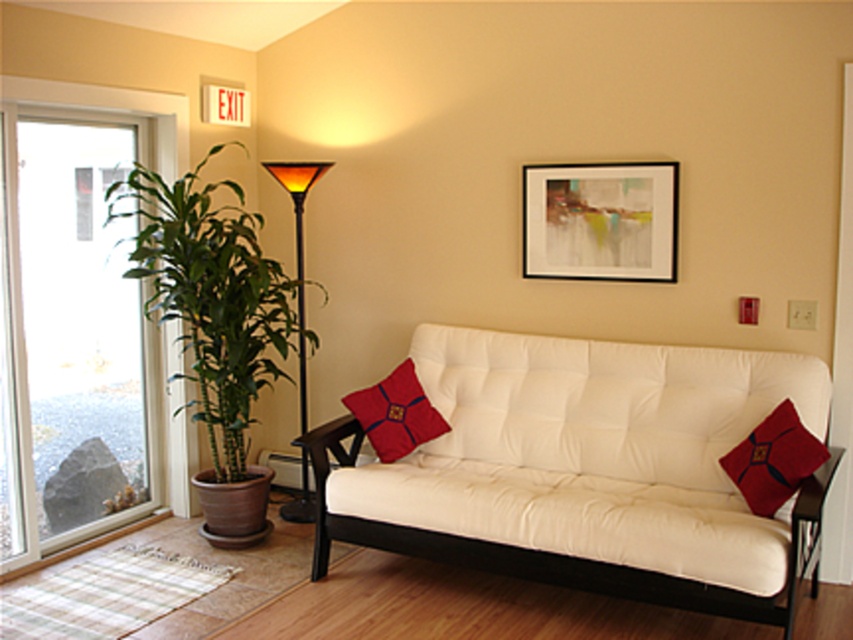
Question: Which point is closer to the camera taking this photo?

Choices:
 (A) (711, 573)
 (B) (70, 483)
 (C) (196, 230)

Answer: (A)

Question: Is transparent glass screen door at lower left positioned at the back of amber glass lamp at center?

Choices:
 (A) yes
 (B) no

Answer: (B)

Question: Which of these objects is positioned closest to the amber glass lamp at center?

Choices:
 (A) white leather couch at center
 (B) velvet red pillow at center

Answer: (B)

Question: Can you confirm if green leafy plant at left is positioned to the right of transparent glass screen door at lower left?

Choices:
 (A) no
 (B) yes

Answer: (A)

Question: Which point appears farthest from the camera in this image?

Choices:
 (A) (134, 339)
 (B) (281, 513)
 (C) (578, 474)
 (D) (434, 417)

Answer: (A)

Question: Can you confirm if clear glass door at left is positioned below velvet red pillow at right?

Choices:
 (A) yes
 (B) no

Answer: (B)